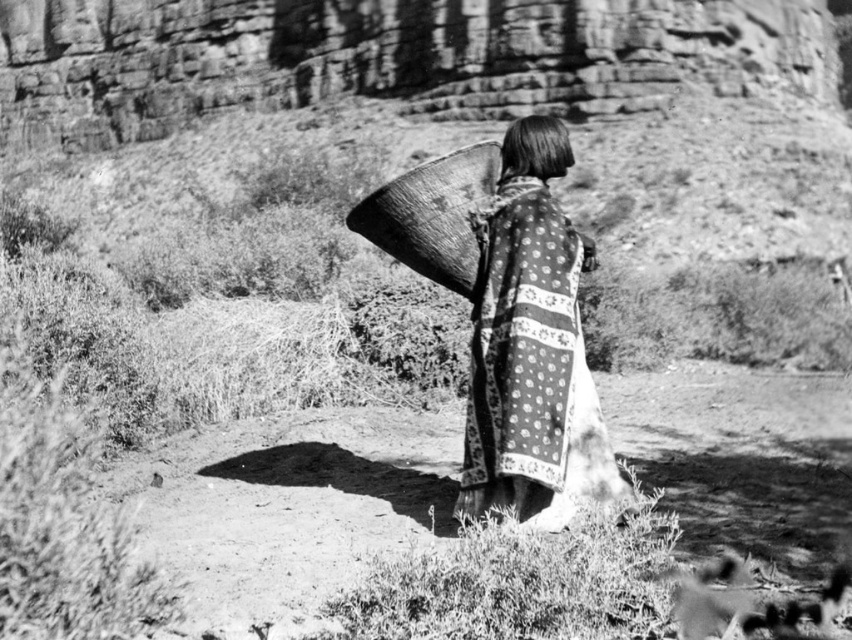
Can you confirm if patterned fabric shawl at center is positioned below wooden basket at upper center?

No, patterned fabric shawl at center is not below wooden basket at upper center.

Is patterned fabric shawl at center to the left of wooden basket at upper center from the viewer's perspective?

In fact, patterned fabric shawl at center is to the right of wooden basket at upper center.

Who is more forward, (550, 465) or (471, 230)?

Point (550, 465) is more forward.

I want to click on patterned fabric shawl at center, so click(x=532, y=349).

Can you confirm if wooden basket at upper center is positioned to the right of smooth dark hair at center?

Incorrect, wooden basket at upper center is not on the right side of smooth dark hair at center.

This screenshot has width=852, height=640. I want to click on wooden basket at upper center, so click(x=435, y=216).

Can you confirm if patterned fabric shawl at center is positioned to the right of smooth dark hair at center?

No, patterned fabric shawl at center is not to the right of smooth dark hair at center.

Between point (570, 355) and point (524, 176), which one is positioned behind?

The point (524, 176) is more distant.

Image resolution: width=852 pixels, height=640 pixels. In order to click on patterned fabric shawl at center in this screenshot , I will do `click(532, 349)`.